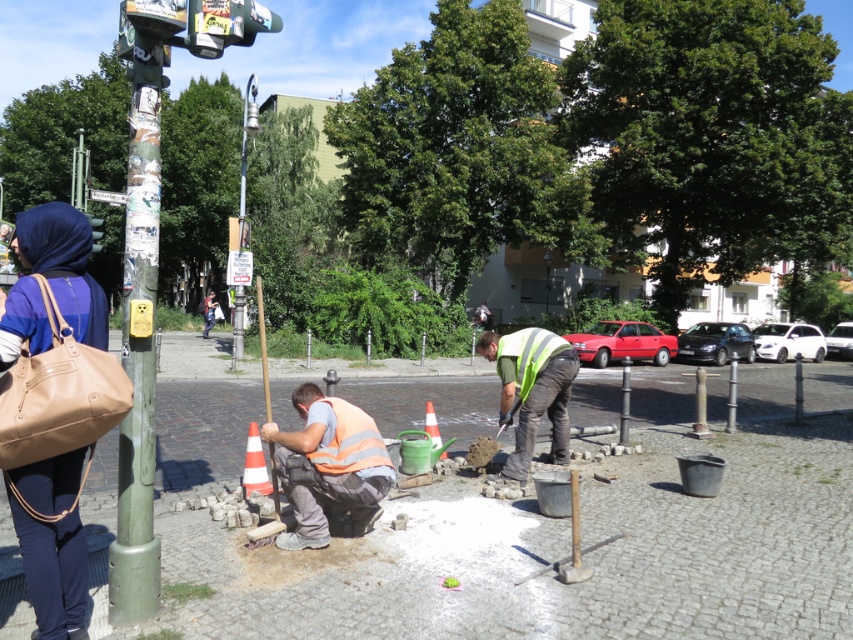
Who is more distant from viewer, (x=314, y=460) or (x=547, y=275)?

Point (x=547, y=275)

Is orange reflective vest at center shorter than brushed metal lamp post at upper center?

Incorrect, orange reflective vest at center's height does not fall short of brushed metal lamp post at upper center's.

Does point (347, 490) come in front of point (546, 285)?

Yes, it is in front of point (546, 285).

Identify the location of orange reflective vest at center. The image size is (853, 640). (329, 467).

Consider the image. Can you confirm if matte brown leather bag at left is positioned above orange reflective safety vest at lower center?

Indeed, matte brown leather bag at left is positioned over orange reflective safety vest at lower center.

Between point (54, 600) and point (376, 435), which one is positioned behind?

The point (376, 435) is more distant.

Locate an element on the screen. matte brown leather bag at left is located at coordinates (64, 266).

Who is positioned more to the right, orange reflective safety vest at lower center or metallic silver streetlight at upper left?

From the viewer's perspective, orange reflective safety vest at lower center appears more on the right side.

In the scene shown: Who is more forward, [357,470] or [241,147]?

Positioned in front is point [357,470].

Locate an element on the screen. orange reflective safety vest at lower center is located at coordinates (350, 442).